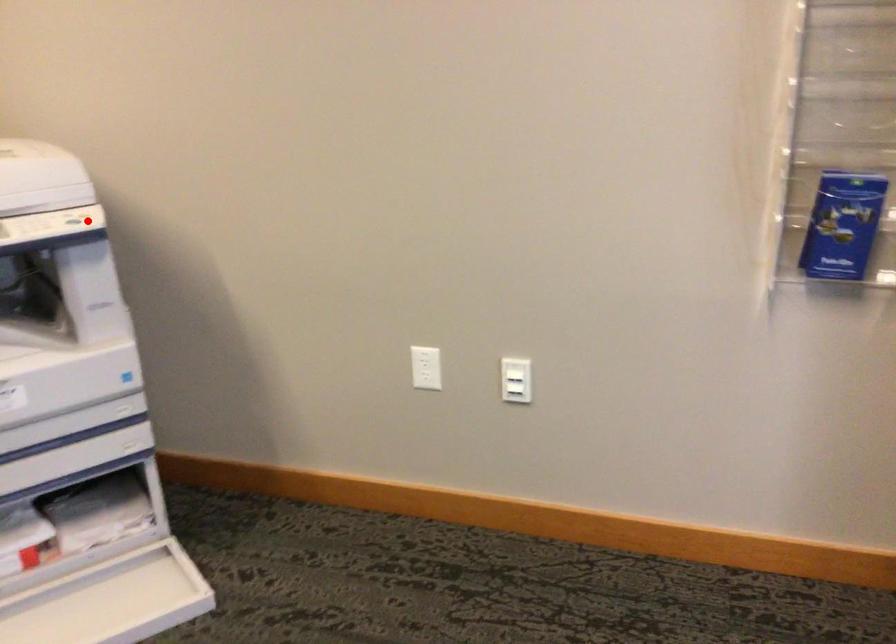
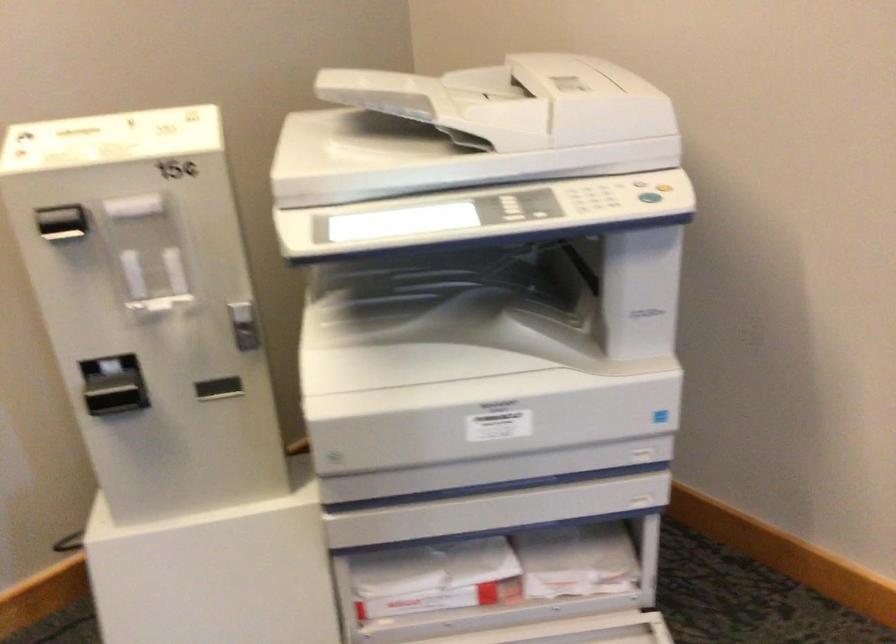
In the second image, find the point that corresponds to the highlighted location in the first image.

(649, 196)